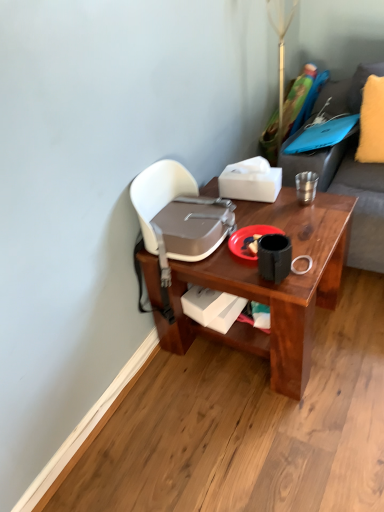
I want to click on vacant area that lies between red matte plate at center and metallic silver coffee cup at upper right, so click(282, 215).